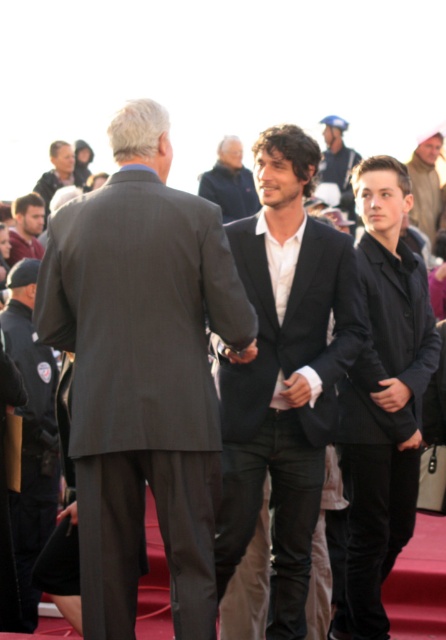
Question: Is black matte blazer at right positioned in front of dark blue uniform at left?

Choices:
 (A) yes
 (B) no

Answer: (A)

Question: Which object is positioned farthest from the matte black suit at center?

Choices:
 (A) blue denim jeans at upper center
 (B) light brown leather jacket at upper right
 (C) black matte blazer at right

Answer: (B)

Question: Which object appears farthest from the camera in this image?

Choices:
 (A) black matte blazer at right
 (B) dark blue uniform at left
 (C) light brown leather jacket at upper right
 (D) dark gray suit at center

Answer: (C)

Question: Which of these objects is positioned farthest from the dark blue jacket at center?

Choices:
 (A) black matte blazer at right
 (B) blue denim jeans at upper center
 (C) dark gray suit at center
 (D) matte black suit at center

Answer: (C)

Question: Can you confirm if black matte blazer at right is bigger than matte black jacket at left?

Choices:
 (A) yes
 (B) no

Answer: (A)

Question: Is light brown leather jacket at upper right behind blue denim jeans at upper center?

Choices:
 (A) no
 (B) yes

Answer: (B)